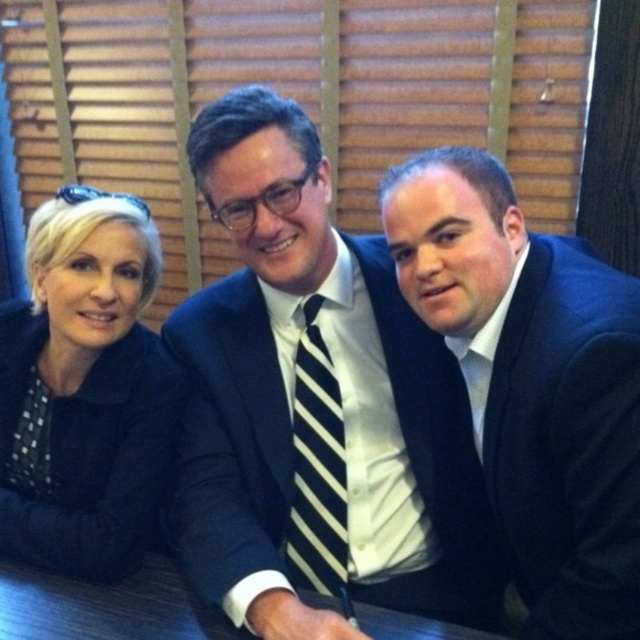
Question: Can you confirm if dark blue suit at center is positioned to the right of matte black suit at right?

Choices:
 (A) yes
 (B) no

Answer: (B)

Question: Can you confirm if matte black suit at right is bigger than black dotted shirt at left?

Choices:
 (A) yes
 (B) no

Answer: (A)

Question: Which point is closer to the camera taking this photo?

Choices:
 (A) (221, 472)
 (B) (572, 513)
 (C) (74, 220)

Answer: (B)

Question: Can you confirm if matte black suit at right is wider than black dotted shirt at left?

Choices:
 (A) no
 (B) yes

Answer: (A)

Question: Which object is the closest to the dark blue suit at center?

Choices:
 (A) black dotted shirt at left
 (B) matte black suit at right

Answer: (A)

Question: Which of the following is the farthest from the observer?

Choices:
 (A) (355, 592)
 (B) (564, 262)
 (C) (3, 390)

Answer: (C)